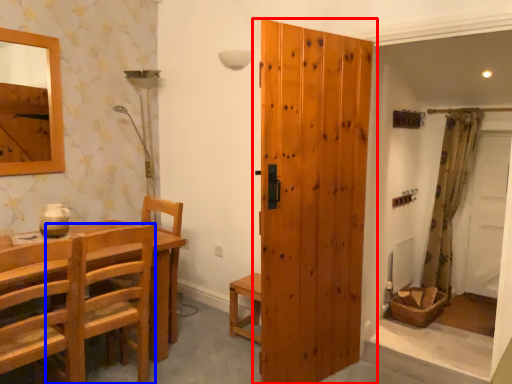
Question: Which of the following is the closest to the observer, door (highlighted by a red box) or chair (highlighted by a blue box)?

Choices:
 (A) door
 (B) chair

Answer: (B)